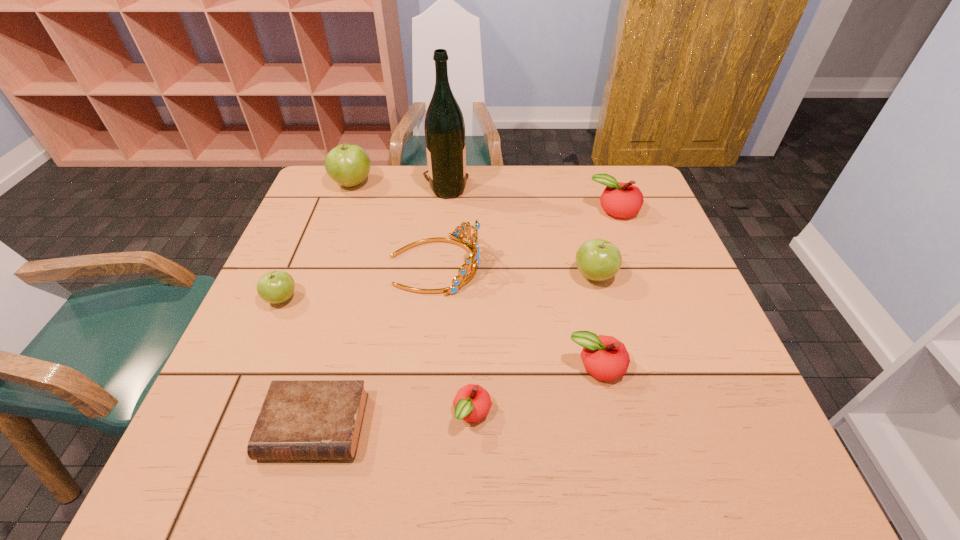
Identify the location of empty space between the tallest apple and the smallest green apple. (317, 241).

Where is `vacant area that lies between the smallest green apple and the tiara`? vacant area that lies between the smallest green apple and the tiara is located at coordinates (358, 282).

Choose which object is the fourth nearest neighbor to the smallest green apple. Please provide its 2D coordinates. Your answer should be formatted as a tuple, i.e. [(x, y)], where the tuple contains the x and y coordinates of a point satisfying the conditions above.

[(472, 402)]

Locate an element on the screen. The height and width of the screenshot is (540, 960). object that is the fifth closest to the wine bottle is located at coordinates (275, 287).

Locate which apple ranks second in proximity to the second nearest red apple. Please provide its 2D coordinates. Your answer should be formatted as a tuple, i.e. [(x, y)], where the tuple contains the x and y coordinates of a point satisfying the conditions above.

[(597, 259)]

Choose which apple is the second nearest neighbor to the second red apple from right to left. Please provide its 2D coordinates. Your answer should be formatted as a tuple, i.e. [(x, y)], where the tuple contains the x and y coordinates of a point satisfying the conditions above.

[(597, 259)]

Choose which green apple is the third nearest neighbor to the second nearest red apple. Please provide its 2D coordinates. Your answer should be formatted as a tuple, i.e. [(x, y)], where the tuple contains the x and y coordinates of a point satisfying the conditions above.

[(347, 164)]

Identify which green apple is the nearest to the second smallest green apple. Please provide its 2D coordinates. Your answer should be formatted as a tuple, i.e. [(x, y)], where the tuple contains the x and y coordinates of a point satisfying the conditions above.

[(347, 164)]

In order to click on red apple that can be found as the second closest to the leftmost red apple in this screenshot , I will do (x=623, y=200).

Locate an element on the screen. The width and height of the screenshot is (960, 540). red apple that is the second closest to the smallest red apple is located at coordinates point(623,200).